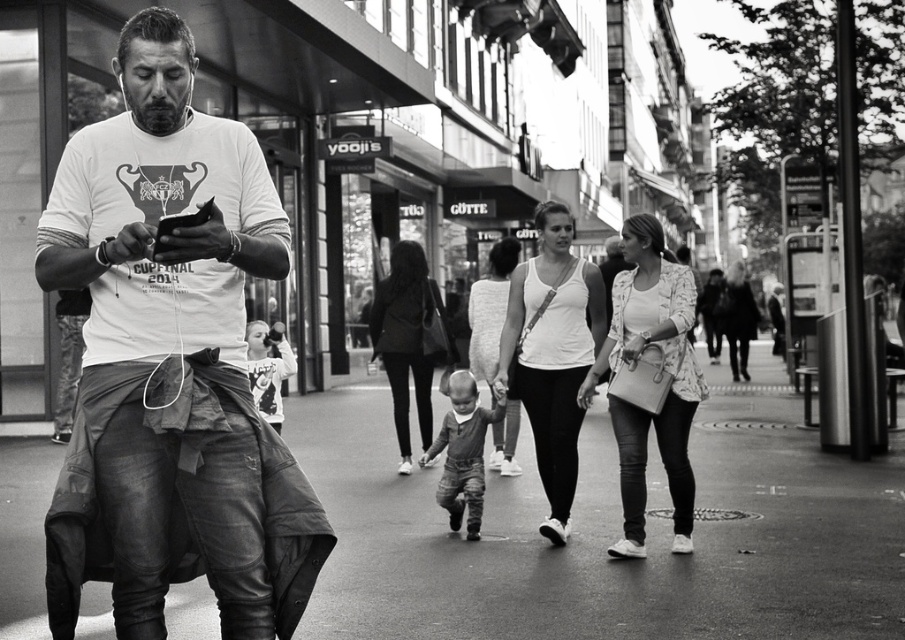
Question: Can you confirm if smooth asphalt at center is thinner than matte white tank top at center?

Choices:
 (A) yes
 (B) no

Answer: (B)

Question: Which object is farther from the camera taking this photo?

Choices:
 (A) matte white tank top at center
 (B) leather jacket at center
 (C) smooth asphalt at center

Answer: (A)

Question: Is matte white tank top at center positioned at the back of light brown textured pants at center?

Choices:
 (A) no
 (B) yes

Answer: (A)

Question: Which of the following is the farthest from the observer?

Choices:
 (A) matte white tank top at center
 (B) leather jacket at center
 (C) smooth asphalt at center

Answer: (A)

Question: Among these points, which one is farthest from the camera?

Choices:
 (A) (784, 444)
 (B) (103, 433)
 (C) (620, 422)

Answer: (A)

Question: Where is white t-shirt at center located in relation to matte white tank top at center in the image?

Choices:
 (A) right
 (B) left

Answer: (B)